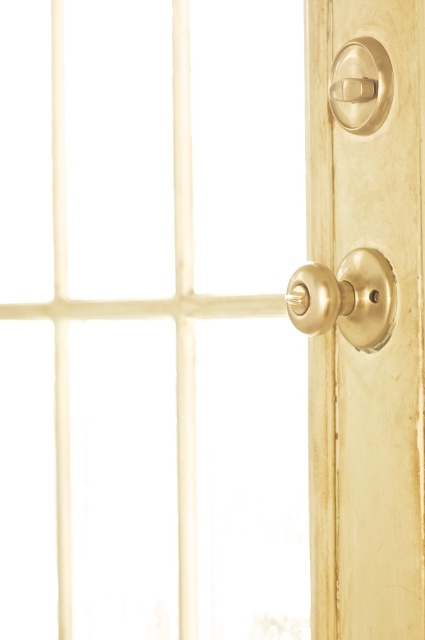
Question: Which point is closer to the camera?

Choices:
 (A) gold polished knob at center right
 (B) brass knob at right

Answer: (A)

Question: Does gold polished knob at center right have a lesser width compared to polished brass knob at upper right?

Choices:
 (A) no
 (B) yes

Answer: (A)

Question: Can you confirm if gold polished knob at center right is wider than polished brass knob at upper right?

Choices:
 (A) yes
 (B) no

Answer: (A)

Question: Which point is closer to the camera?

Choices:
 (A) brass knob at right
 (B) gold polished knob at center right
 (C) polished brass knob at upper right

Answer: (B)

Question: Which point is closer to the camera taking this photo?

Choices:
 (A) (363, 339)
 (B) (407, 234)
 (C) (339, 96)

Answer: (C)

Question: In this image, where is brass knob at right located relative to gold polished knob at center right?

Choices:
 (A) above
 (B) below

Answer: (B)